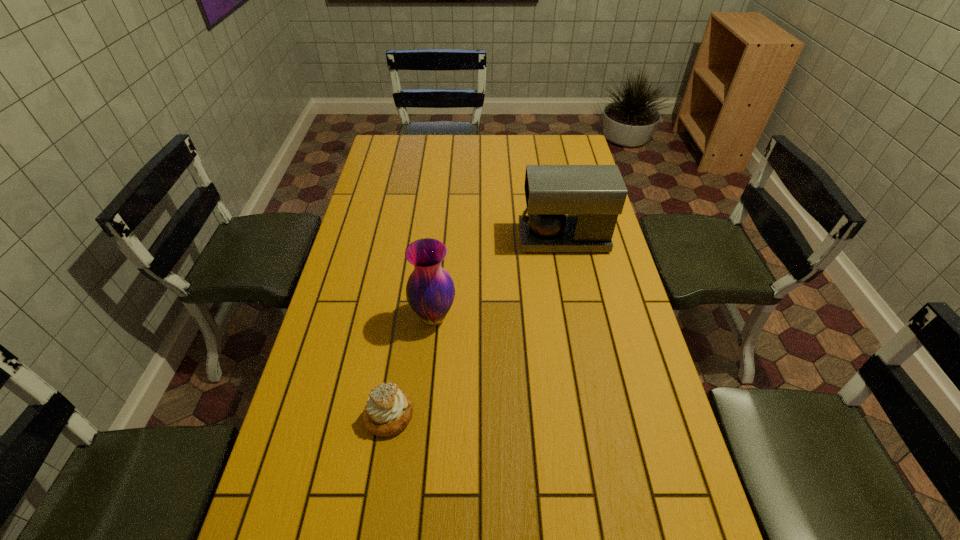
This screenshot has width=960, height=540. Find the location of `the second nearest object`. the second nearest object is located at coordinates (430, 291).

This screenshot has width=960, height=540. What are the coordinates of `the rightmost object` in the screenshot? It's located at (570, 208).

I want to click on the farthest object, so click(570, 208).

This screenshot has height=540, width=960. I want to click on the shortest object, so click(x=389, y=410).

The image size is (960, 540). I want to click on the nearest object, so click(x=389, y=410).

This screenshot has height=540, width=960. I want to click on free space located 0.270m on the right of the second nearest object, so click(550, 316).

At what (x,y) coordinates should I click in order to perform the action: click on vacant space situated on the carafe side of the rightmost object. Please return your answer as a coordinate pair (x, y). The height and width of the screenshot is (540, 960). Looking at the image, I should click on (415, 239).

You are a GUI agent. You are given a task and a screenshot of the screen. Output one action in this format:
    pyautogui.click(x=<x>, y=<y>)
    Task: Click on the vacant space located 0.050m on the carafe side of the rightmost object
    
    Given the screenshot: What is the action you would take?
    pyautogui.click(x=505, y=239)

Locate an element on the screen. vacant region located 0.170m on the carafe side of the rightmost object is located at coordinates (470, 239).

This screenshot has height=540, width=960. Identify the location of free location located on the back of the shortest object. (409, 286).